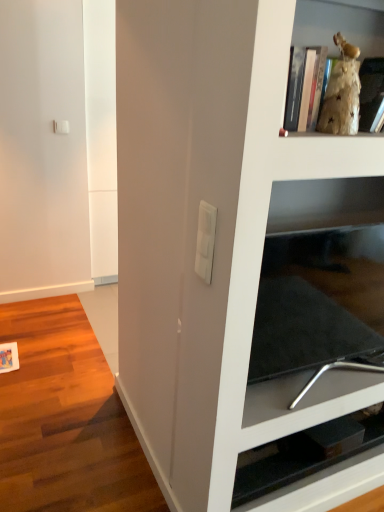
Question: Should I look upward or downward to see white plastic light switch at center?

Choices:
 (A) down
 (B) up

Answer: (B)

Question: Are gold textured figurine at upper right, placed as the first shelf when sorted from top to bottom, and white plastic light switch at center making contact?

Choices:
 (A) yes
 (B) no

Answer: (B)

Question: Is gold textured figurine at upper right, placed as the first shelf when sorted from top to bottom, oriented towards white plastic light switch at center?

Choices:
 (A) yes
 (B) no

Answer: (B)

Question: Is gold textured figurine at upper right, the second shelf from the back, positioned beyond the bounds of white plastic light switch at center?

Choices:
 (A) yes
 (B) no

Answer: (A)

Question: From a real-world perspective, is gold textured figurine at upper right, which appears as the 1th shelf when viewed from the front, beneath white plastic light switch at center?

Choices:
 (A) no
 (B) yes

Answer: (A)

Question: Is gold textured figurine at upper right, placed as the first shelf when sorted from top to bottom, at the left side of white plastic light switch at center?

Choices:
 (A) yes
 (B) no

Answer: (B)

Question: Considering the relative sizes of gold textured figurine at upper right, which appears as the 1th shelf when viewed from the front, and white plastic light switch at center in the image provided, is gold textured figurine at upper right, which appears as the 1th shelf when viewed from the front, smaller than white plastic light switch at center?

Choices:
 (A) no
 (B) yes

Answer: (A)

Question: Is white plastic light switch at center located within black glossy tv stand at lower right, marked as the 1th shelf in a back-to-front arrangement?

Choices:
 (A) no
 (B) yes

Answer: (A)

Question: From the image's perspective, is black glossy tv stand at lower right, marked as the 1th shelf in a back-to-front arrangement, over white plastic light switch at center?

Choices:
 (A) yes
 (B) no

Answer: (B)

Question: From the image's perspective, is black glossy tv stand at lower right, marked as the 1th shelf in a back-to-front arrangement, located beneath white plastic light switch at center?

Choices:
 (A) no
 (B) yes

Answer: (B)

Question: Does black glossy tv stand at lower right, the second shelf from the front, come in front of white plastic light switch at center?

Choices:
 (A) no
 (B) yes

Answer: (A)

Question: Does black glossy tv stand at lower right, marked as the first shelf in a bottom-to-top arrangement, have a lesser width compared to white plastic light switch at center?

Choices:
 (A) no
 (B) yes

Answer: (A)

Question: Is black glossy tv stand at lower right, marked as the first shelf in a bottom-to-top arrangement, oriented away from white plastic light switch at center?

Choices:
 (A) yes
 (B) no

Answer: (B)

Question: Is gold textured figurine at upper right, the second shelf ordered from the bottom, smaller than black glossy tv stand at lower right, marked as the first shelf in a bottom-to-top arrangement?

Choices:
 (A) yes
 (B) no

Answer: (B)